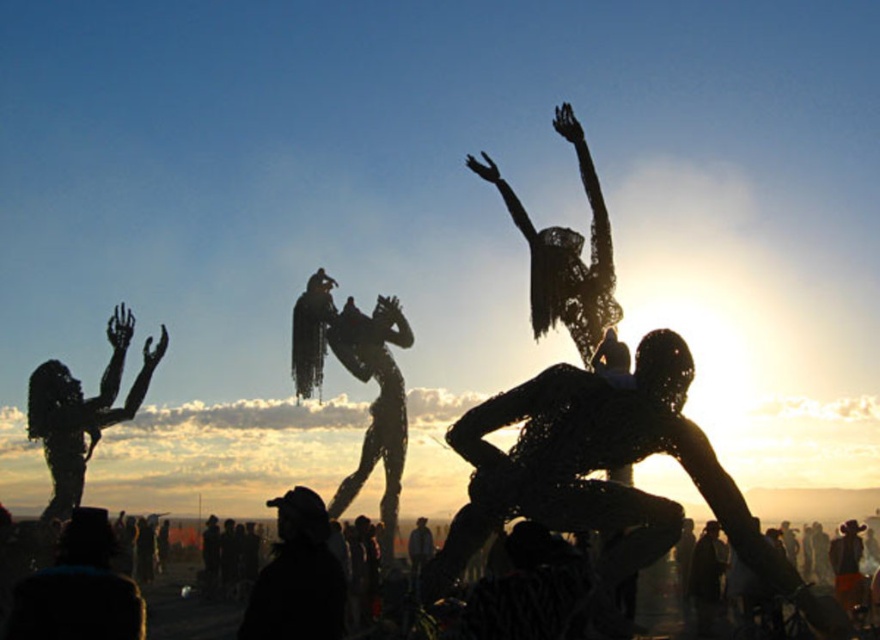
Between silvery wire sculpture at left and black fabric hat at lower center, which one appears on the right side from the viewer's perspective?

black fabric hat at lower center

Which of these two, silvery wire sculpture at left or black fabric hat at lower center, stands shorter?

Standing shorter between the two is black fabric hat at lower center.

Which is behind, point (159, 348) or point (302, 614)?

Positioned behind is point (159, 348).

At what (x,y) coordinates should I click in order to perform the action: click on silvery wire sculpture at left. Please return your answer as a coordinate pair (x, y). The width and height of the screenshot is (880, 640). Looking at the image, I should click on (83, 410).

From the picture: Between black fabric hat at lower center and black fabric crowd at lower left, which one is positioned higher?

black fabric hat at lower center

Is black fabric hat at lower center taller than black fabric crowd at lower left?

Correct, black fabric hat at lower center is much taller as black fabric crowd at lower left.

What do you see at coordinates (297, 577) in the screenshot?
I see `black fabric hat at lower center` at bounding box center [297, 577].

At what (x,y) coordinates should I click in order to perform the action: click on black fabric hat at lower center. Please return your answer as a coordinate pair (x, y). The height and width of the screenshot is (640, 880). Looking at the image, I should click on (297, 577).

Is silvery wire sculpture at left to the right of black fabric crowd at lower left from the viewer's perspective?

No, silvery wire sculpture at left is not to the right of black fabric crowd at lower left.

Looking at this image, is silvery wire sculpture at left smaller than black fabric crowd at lower left?

Yes, silvery wire sculpture at left is smaller than black fabric crowd at lower left.

What do you see at coordinates (83, 410) in the screenshot?
I see `silvery wire sculpture at left` at bounding box center [83, 410].

You are a GUI agent. You are given a task and a screenshot of the screen. Output one action in this format:
    pyautogui.click(x=<x>, y=<y>)
    Task: Click on the silvery wire sculpture at left
    The image size is (880, 640).
    Given the screenshot: What is the action you would take?
    pyautogui.click(x=83, y=410)